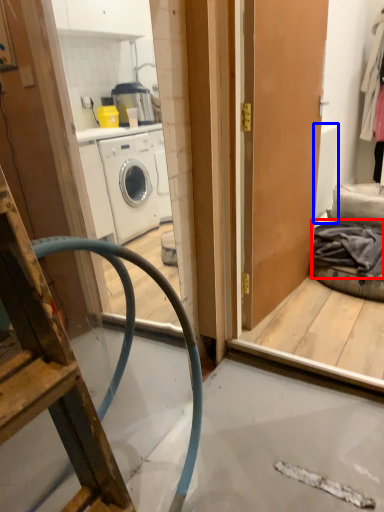
Question: Which object appears closest to the camera in this image, clothing (highlighted by a red box) or radiator (highlighted by a blue box)?

Choices:
 (A) clothing
 (B) radiator

Answer: (A)